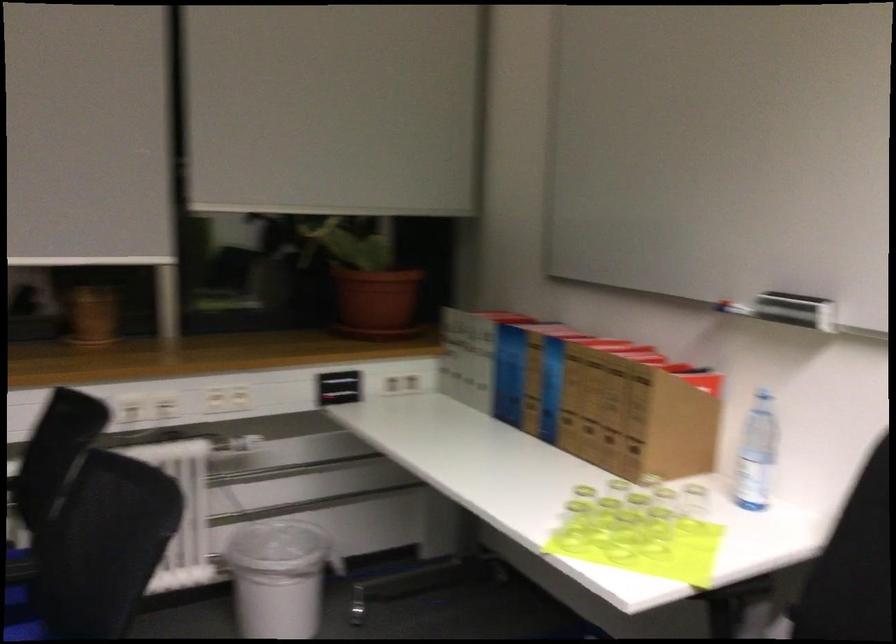
At what (x,y) coordinates should I click in order to perform the action: click on black chair sitting surface. Please return your answer as a coordinate pair (x, y). Looking at the image, I should click on (23, 603).